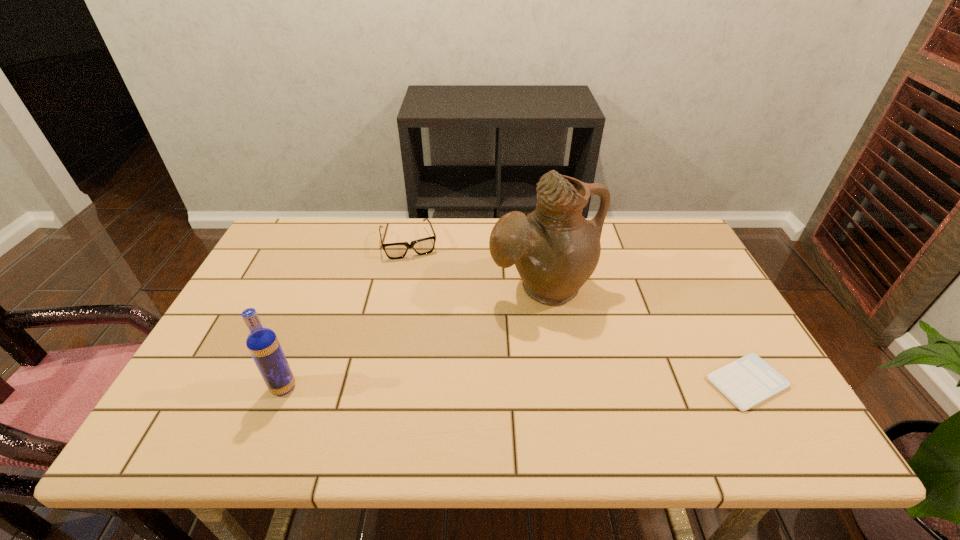
You are a GUI agent. You are given a task and a screenshot of the screen. Output one action in this format:
    pyautogui.click(x=<x>, y=<y>)
    Task: Click on the vacant spot on the desktop that is between the vodka and the calculator and is positioned at the spout of the pitcher
    This screenshot has width=960, height=540.
    Given the screenshot: What is the action you would take?
    pyautogui.click(x=578, y=384)

You are a GUI agent. You are given a task and a screenshot of the screen. Output one action in this format:
    pyautogui.click(x=<x>, y=<y>)
    Task: Click on the vacant space on the desktop that is between the third shortest object and the shortest object and is positioned on the front-facing side of the second shortest object
    The image size is (960, 540).
    Given the screenshot: What is the action you would take?
    pyautogui.click(x=447, y=386)